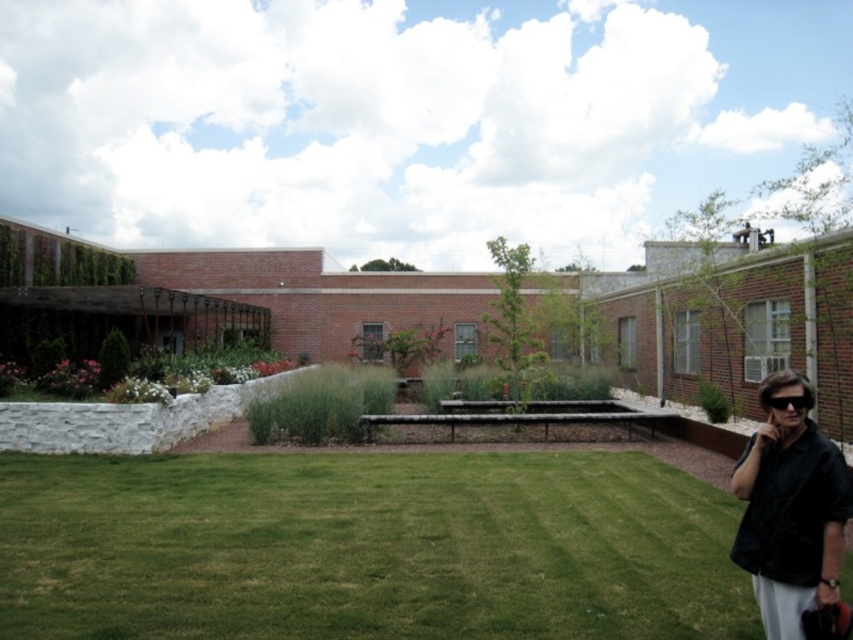
Looking at this image, is black matte jacket at lower right below black plastic goggles at lower right?

Result: Yes, black matte jacket at lower right is below black plastic goggles at lower right.

Between point (790, 438) and point (792, 403), which one is positioned in front?

Point (792, 403) is in front.

At what (x,y) coordinates should I click in order to perform the action: click on black matte jacket at lower right. Please return your answer as a coordinate pair (x, y). Image resolution: width=853 pixels, height=640 pixels. Looking at the image, I should click on (790, 512).

Who is taller, green grass at lower center or black plastic goggles at lower right?

With more height is green grass at lower center.

Between point (218, 634) and point (779, 397), which one is positioned in front?

Point (779, 397) is in front.

Is point (471, 548) less distant than point (804, 406)?

No, it is behind (804, 406).

Locate an element on the screen. green grass at lower center is located at coordinates (367, 548).

Which is below, green grass at lower center or black matte jacket at lower right?

green grass at lower center is below.

Who is higher up, green grass at lower center or black matte jacket at lower right?

Positioned higher is black matte jacket at lower right.

Locate an element on the screen. This screenshot has width=853, height=640. green grass at lower center is located at coordinates pos(367,548).